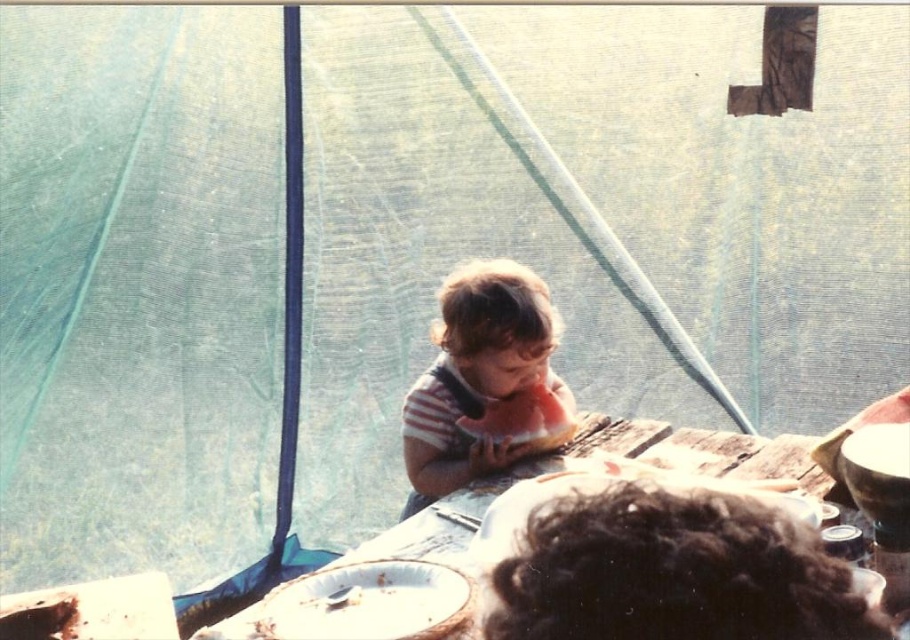
You are setting up a picnic and need to place the striped cotton shirt at center and the red matte watermelon at center on the table. According to the scene, which item should be placed to the left of the other?

The striped cotton shirt at center is positioned on the left side of red matte watermelon at center, so the striped cotton shirt at center should be placed to the left of the red matte watermelon at center.

You are setting up a picnic and need to place a red matte watermelon at center on the wooden table at center. However, the table is already occupied. Where exactly on the table should you place the watermelon to ensure it is centered correctly?

The wooden table at center is to the right of the red matte watermelon at center, so you should move the watermelon to the left side of the table to center it properly.

You are standing at the entrance of the tent and see the point marked at coordinates (743,456). What object is located at that point?

The point at coordinates (743,456) marks the wooden table at center.